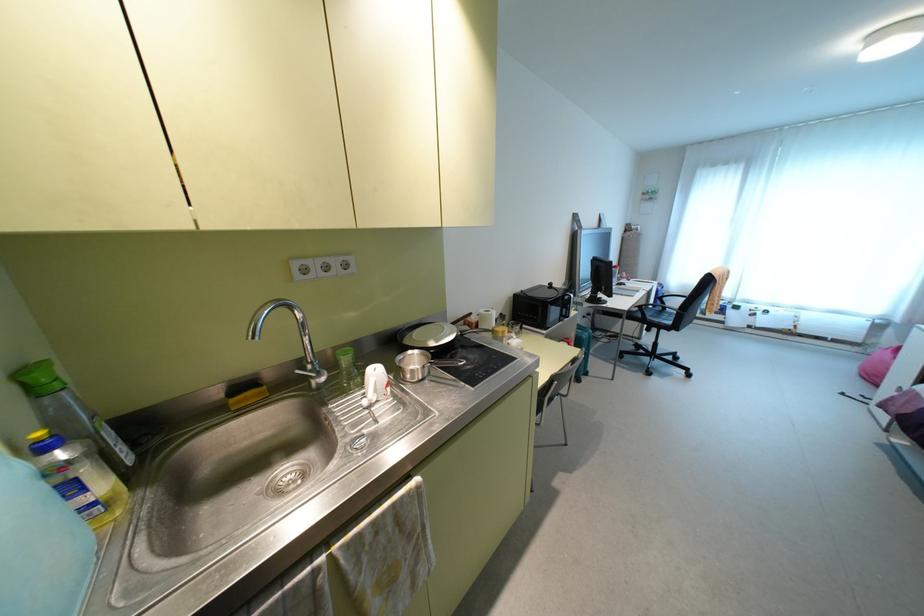
This screenshot has height=616, width=924. In order to click on metal pot handle in this screenshot , I will do `click(485, 331)`.